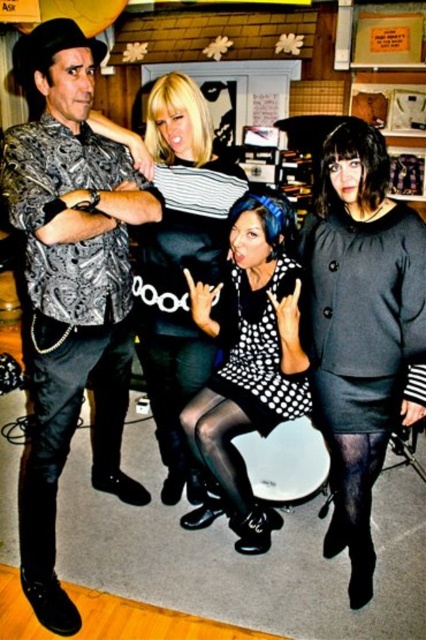
Is matte black shirt at left thinner than polka dot dress at center?

No.

Which is behind, point (115, 208) or point (244, 346)?

The point (244, 346) is behind.

Where is `matte black shirt at left`? matte black shirt at left is located at coordinates (71, 289).

Measure the distance between point (120, 189) and camera.

Point (120, 189) is 1.87 meters away from camera.

Is matte black shirt at left further to camera compared to black matte dress at center?

No.

Locate an element on the screen. This screenshot has width=426, height=640. matte black shirt at left is located at coordinates (71, 289).

Between black leather pants at lower left and black dotted dress at center, which one has more height?

black leather pants at lower left is taller.

Does black leather pants at lower left have a greater width compared to black dotted dress at center?

Yes, black leather pants at lower left is wider than black dotted dress at center.

Between point (81, 397) and point (268, 413), which one is positioned behind?

Point (268, 413)

This screenshot has width=426, height=640. Find the location of `black leather pants at lower left`. black leather pants at lower left is located at coordinates (69, 426).